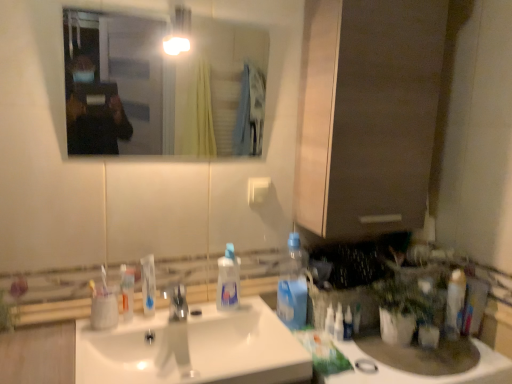
Question: From the image's perspective, is polished chrome faucet at center above or below clear glass mirror at upper center?

Choices:
 (A) below
 (B) above

Answer: (A)

Question: Is polished chrome faucet at center in front of or behind clear glass mirror at upper center in the image?

Choices:
 (A) behind
 (B) front

Answer: (A)

Question: Which object is positioned farthest from the white plastic toothbrush at left, the first toothbrush from the left?

Choices:
 (A) white glossy toothpaste at center
 (B) transparent plastic spray bottle at center, the third cleaning product when ordered from right to left
 (C) clear glass mirror at upper center
 (D) white glossy sink at center
 (E) white plastic light switch at upper center

Answer: (C)

Question: Which object is the farthest from the white glossy sink at center?

Choices:
 (A) white glossy counter top at lower right
 (B) blue plastic bottle at center-right, which is the second cleaning product in left-to-right order
 (C) clear plastic spray bottle at right, placed as the first cleaning product when sorted from right to left
 (D) clear glass mirror at upper center
 (E) transparent plastic spray bottle at center, the third cleaning product when ordered from right to left

Answer: (D)